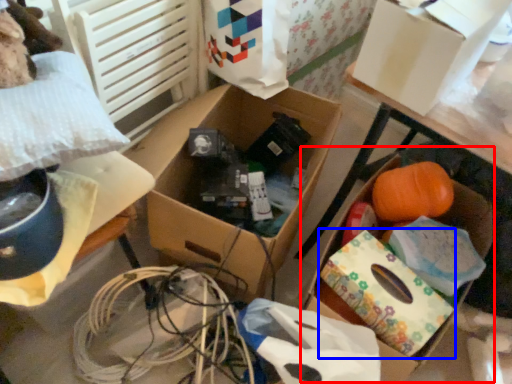
Question: Which object appears closest to the camera in this image, storage box (highlighted by a red box) or cardboard box (highlighted by a blue box)?

Choices:
 (A) storage box
 (B) cardboard box

Answer: (B)